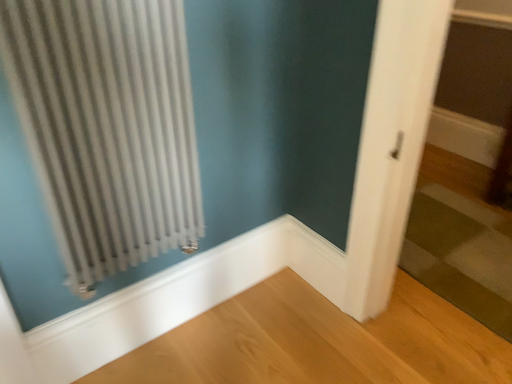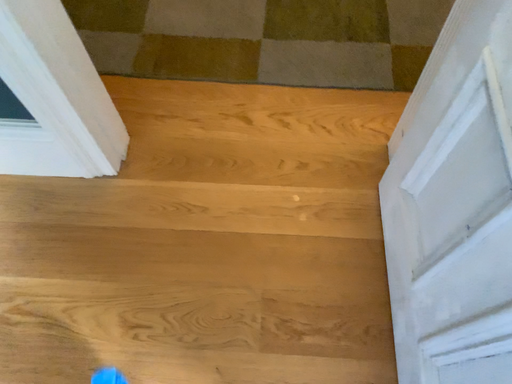
Question: How did the camera likely rotate when shooting the video?

Choices:
 (A) rotated right
 (B) rotated left

Answer: (A)